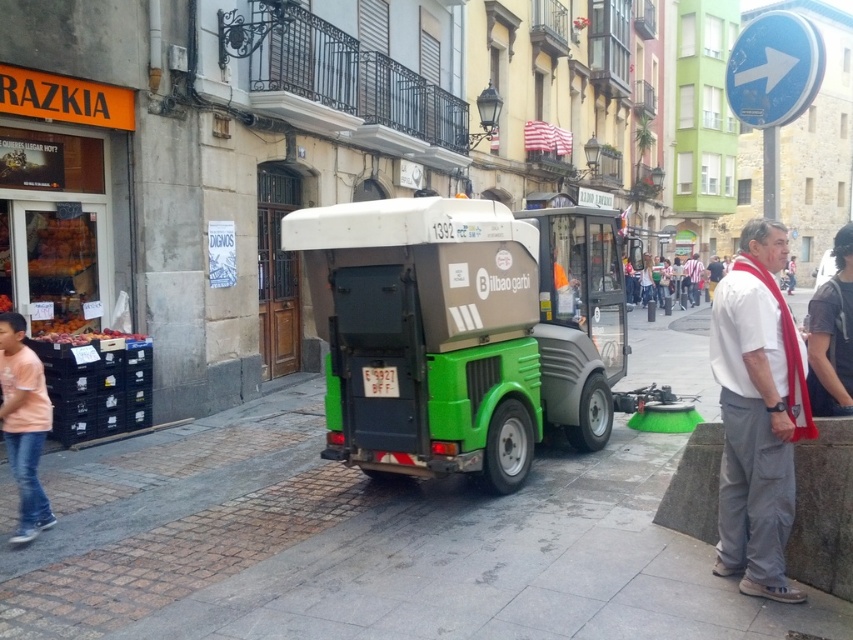
You are standing at the point with coordinates point (18, 460) and want to walk to the point point (827, 403). Which direction should you face to walk towards your destination?

You should face north because point (18, 460) is behind point (827, 403), meaning the destination is in front of you when facing north.

You are a delivery person who needs to park your electric scooter. The parking area is marked by the green rubber pavement at center. Where exactly should you position your scooter to park it correctly?

You should position your scooter precisely at the coordinates point (364, 545) where the green rubber pavement at center is located.